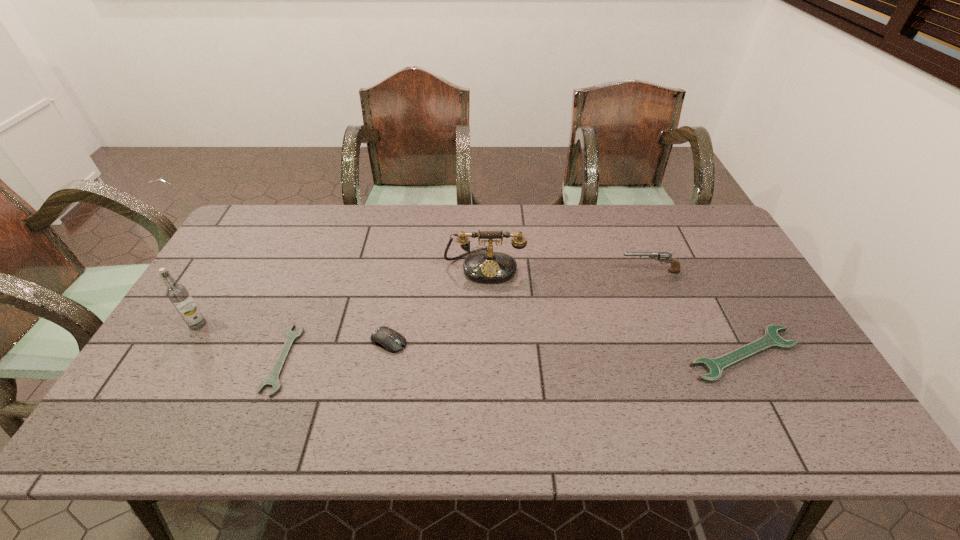
Where is `free point that satisfies the following two spatial constraints: 1. on the label of the tallest object; 2. on the right side of the third object from left to right`? Image resolution: width=960 pixels, height=540 pixels. free point that satisfies the following two spatial constraints: 1. on the label of the tallest object; 2. on the right side of the third object from left to right is located at coordinates (188, 341).

This screenshot has width=960, height=540. Identify the location of free space that satisfies the following two spatial constraints: 1. aiming along the barrel of the fourth shortest object; 2. on the front side of the shorter wrench. (684, 360).

The height and width of the screenshot is (540, 960). In order to click on free space that satisfies the following two spatial constraints: 1. on the label of the vodka; 2. on the left side of the fourth tallest object in this screenshot , I will do `click(188, 341)`.

Locate an element on the screen. vacant region that satisfies the following two spatial constraints: 1. aiming along the barrel of the gun; 2. on the left side of the fifth tallest object is located at coordinates (683, 354).

This screenshot has width=960, height=540. What are the coordinates of `free space that satisfies the following two spatial constraints: 1. on the label of the fifth tallest object; 2. on the right side of the tallest object` in the screenshot? It's located at (180, 354).

Where is `free location that satisfies the following two spatial constraints: 1. on the label of the vodka; 2. on the left side of the computer equipment`? The height and width of the screenshot is (540, 960). free location that satisfies the following two spatial constraints: 1. on the label of the vodka; 2. on the left side of the computer equipment is located at coordinates (188, 341).